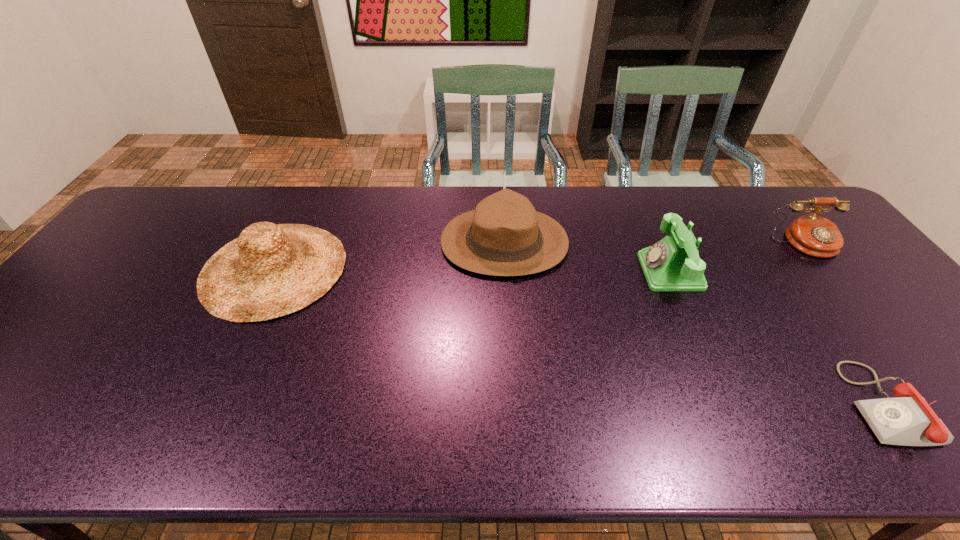
Locate an element on the screen. vacant region located 0.400m on the dial of the third object from right to left is located at coordinates (501, 272).

Find the location of a particular element. free space located on the left of the leftmost object is located at coordinates (145, 269).

Locate an element on the screen. Image resolution: width=960 pixels, height=540 pixels. vacant space situated on the dial of the second shortest telephone is located at coordinates (884, 342).

Find the location of a particular element. fedora that is at the far edge is located at coordinates (504, 236).

Where is `sunhat present at the far edge`? sunhat present at the far edge is located at coordinates (270, 270).

Identify the location of telephone at the far edge. The height and width of the screenshot is (540, 960). (813, 235).

Find the location of `object that is at the right edge`. object that is at the right edge is located at coordinates (813, 235).

I want to click on object that is at the far right corner, so click(813, 235).

Find the location of a particular element. The width and height of the screenshot is (960, 540). free space at the far edge of the desktop is located at coordinates (688, 201).

Locate an element on the screen. vacant area at the near edge is located at coordinates (204, 456).